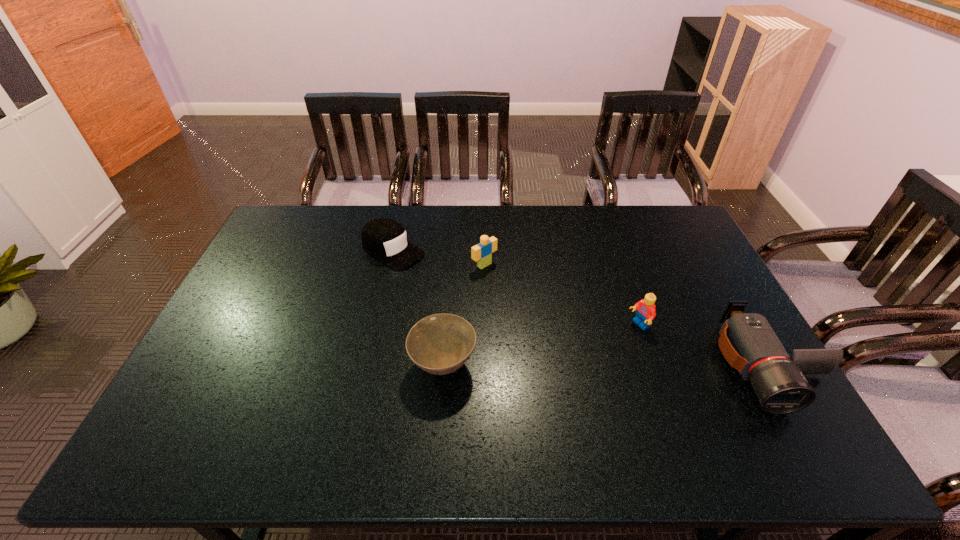
In order to click on vacant spot on the desktop that is between the bowl and the rightmost object and is positioned on the face of the second object from right to left in this screenshot , I will do `click(564, 365)`.

Identify the location of free space on the desktop that is between the bowl and the rightmost object and is positioned on the face of the left Lego. tap(612, 365).

Locate an element on the screen. The height and width of the screenshot is (540, 960). vacant space on the desktop that is between the bowl and the camcorder and is positioned on the front-facing side of the cap is located at coordinates (571, 365).